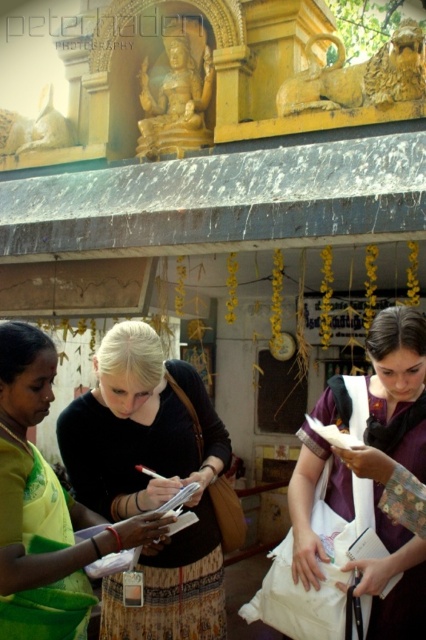
Question: Does black fabric skirt at center appear over white fabric bag at center?

Choices:
 (A) yes
 (B) no

Answer: (B)

Question: Does black fabric skirt at center appear over white fabric bag at center?

Choices:
 (A) no
 (B) yes

Answer: (A)

Question: Can you confirm if black fabric skirt at center is positioned to the left of white fabric bag at center?

Choices:
 (A) yes
 (B) no

Answer: (A)

Question: Which point is closer to the camera?

Choices:
 (A) white fabric bag at center
 (B) black fabric skirt at center

Answer: (A)